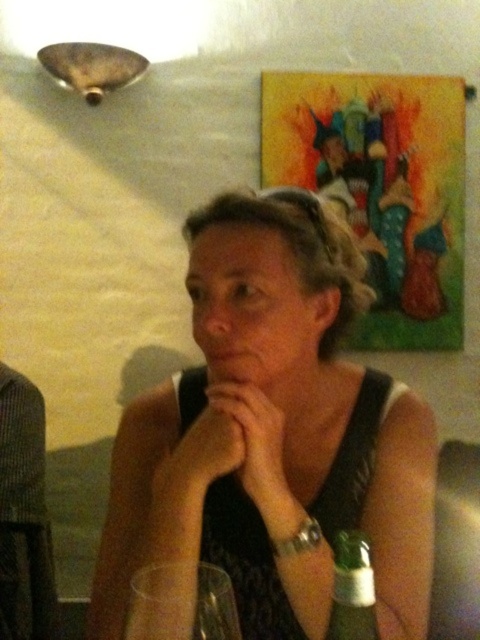
Consider the image. You are an interior designer assessing the visual balance of the scene. Considering the size of the matte black tank top at center and the green glass bottle at lower right, which object would you say dominates the composition in terms of size?

The matte black tank top at center dominates the composition in terms of size as it is larger than the green glass bottle at lower right.

You are taking a photo of the scene and want to ensure that the point at coordinate point (167, 566) is in focus. What is the minimum distance you need to set your camera focus to capture this point clearly?

The point at coordinate point (167, 566) is 21.15 inches from the camera, so you need to set the camera focus to at least 21.15 inches to capture it clearly.